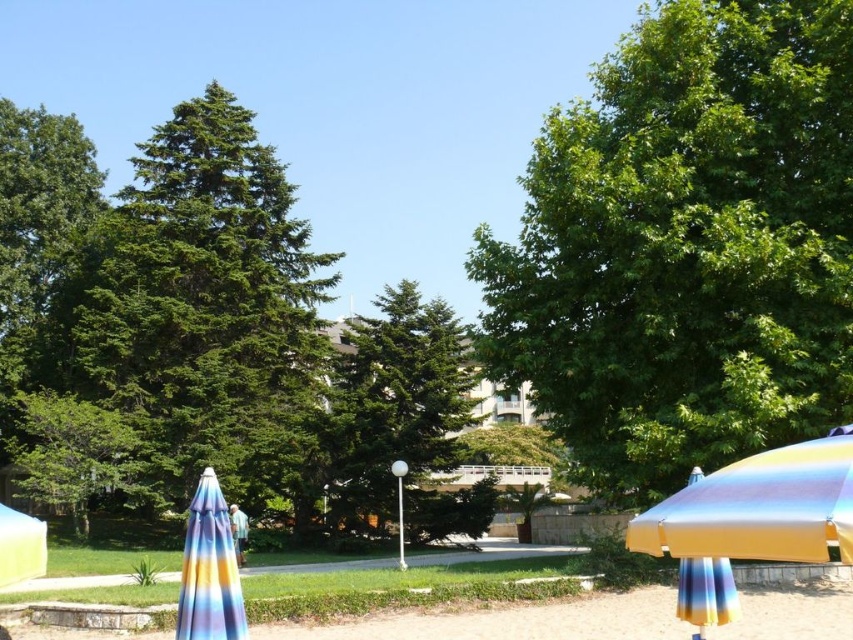
You are a photographer setting up equipment between the metallic rainbow umbrella at lower right and the multicolored fabric umbrella at lower left. The equipment requires a minimum of 4 meters of space to operate safely. Based on the scene, can you safely set up your equipment here?

The metallic rainbow umbrella at lower right and the multicolored fabric umbrella at lower left are 3.91 meters apart, which is less than the required 4 meters. Therefore, you cannot safely set up your equipment here due to insufficient space.

You are standing at the center of the scene and want to place a new bench exactly halfway between the multicolored fabric umbrella at lower left and another object. Which object should you choose to ensure the bench is positioned correctly?

The bench should be placed halfway between the multicolored fabric umbrella at lower left and the green bamboo dock at lower right, as the multicolored fabric umbrella at lower left is located at point (x=209, y=570) and the green bamboo dock at lower right is at point (x=236, y=589), making their midpoint suitable for the bench.